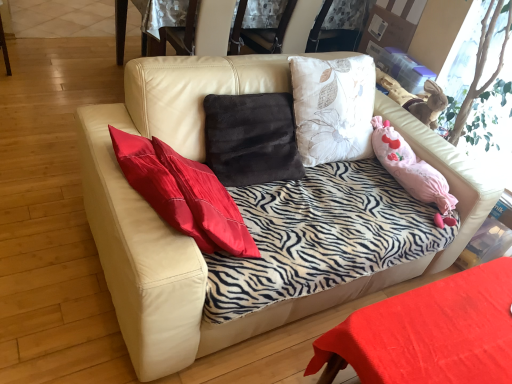
Question: From a real-world perspective, is leather at upper center positioned above or below smooth red table at lower right?

Choices:
 (A) above
 (B) below

Answer: (A)

Question: Considering the positions of leather at upper center and smooth red table at lower right in the image, is leather at upper center wider or thinner than smooth red table at lower right?

Choices:
 (A) wide
 (B) thin

Answer: (B)

Question: Estimate the real-world distances between objects in this image. Which object is closer to the leather couch at center?

Choices:
 (A) smooth red table at lower right
 (B) leather at upper center

Answer: (A)

Question: Estimate the real-world distances between objects in this image. Which object is closer to the leather couch at center?

Choices:
 (A) leather at upper center
 (B) smooth red table at lower right

Answer: (B)